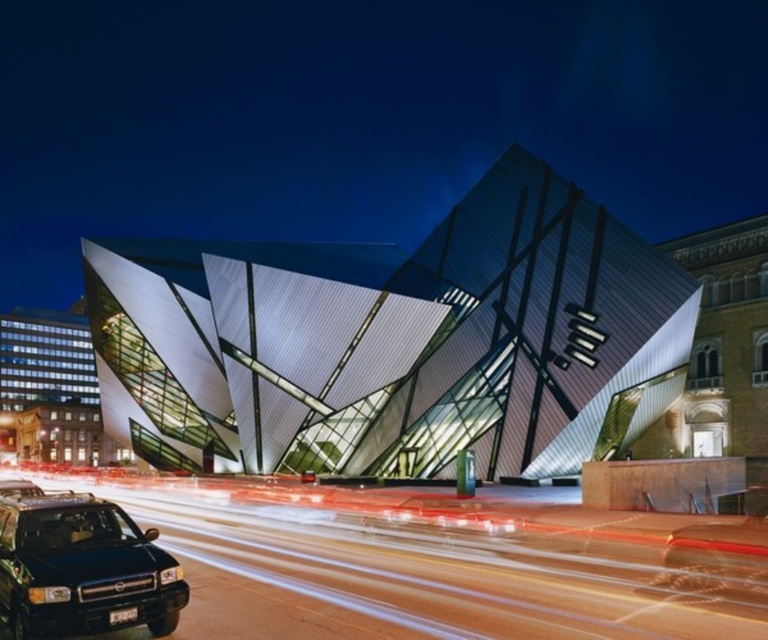
From the picture: You are a photographer who wants to capture the polished glass building at center and the black matte suv at lower left in a single frame. Given that the camera can only focus on objects within a 10 meter width, can both objects fit in the frame?

The polished glass building at center is wider than the black matte suv at lower left. Since the camera can only focus on objects within a 10 meter width, both objects can fit in the frame as long as their combined width does not exceed 10 meters. However, the exact feasibility depends on the actual dimensions of each object, which are not provided here.

Based on the photo, you are a photographer who wants to capture a photo of the polished glass building at center and the black matte suv at lower left. Which object appears larger in the photo?

The polished glass building at center appears larger than the black matte suv at lower left because it is taller.

You are a delivery driver who needs to park your black matte suv at lower left as close as possible to the polished glass building at center. The parking lot has a 50 meter limit for parking. Can you park your vehicle within the limit?

The distance between the polished glass building at center and the black matte suv at lower left is 49.05 meters, which is under the 50 meter limit. Therefore, the suv can be parked within the allowed distance.